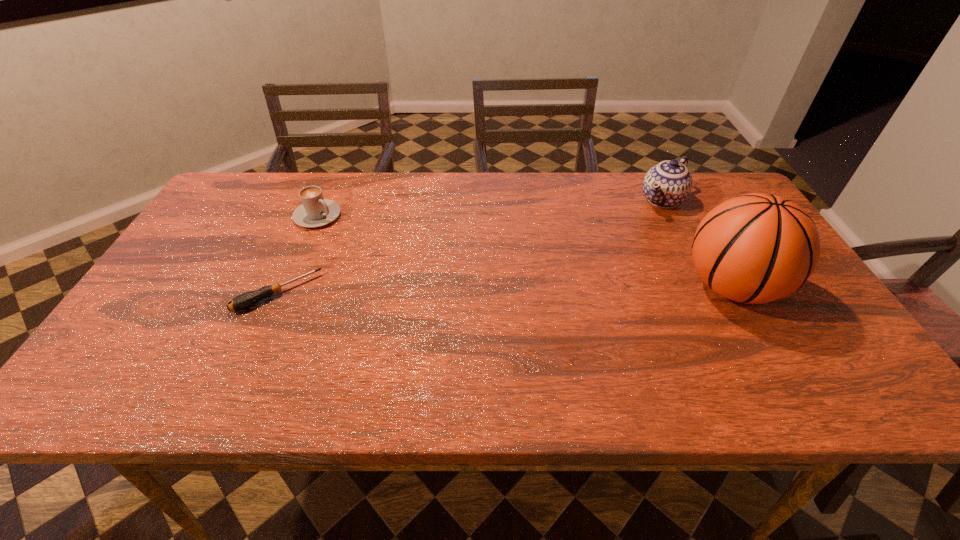
You are a GUI agent. You are given a task and a screenshot of the screen. Output one action in this format:
    pyautogui.click(x=<x>, y=<y>)
    Task: Click on the vacant point located to the right of the third tallest object
    
    Given the screenshot: What is the action you would take?
    pyautogui.click(x=427, y=276)

This screenshot has height=540, width=960. In order to click on vacant space located 0.220m to the right of the third tallest object in this screenshot , I will do pos(390,255).

Locate an element on the screen. chinaware that is at the far edge is located at coordinates (668, 184).

What are the coordinates of `cappuccino situated at the far edge` in the screenshot? It's located at (315, 211).

What are the coordinates of `basketball present at the right edge` in the screenshot? It's located at (755, 248).

Find the location of a particular element. This screenshot has height=540, width=960. chinaware that is at the right edge is located at coordinates point(668,184).

At what (x,y) coordinates should I click in order to perform the action: click on object situated at the far right corner. Please return your answer as a coordinate pair (x, y). Image resolution: width=960 pixels, height=540 pixels. Looking at the image, I should click on (668, 184).

Find the location of a particular element. The width and height of the screenshot is (960, 540). vacant space at the far edge of the desktop is located at coordinates (348, 214).

Image resolution: width=960 pixels, height=540 pixels. I want to click on vacant region at the near edge of the desktop, so click(x=560, y=341).

Where is `vacant space at the left edge of the desktop`? vacant space at the left edge of the desktop is located at coordinates (195, 285).